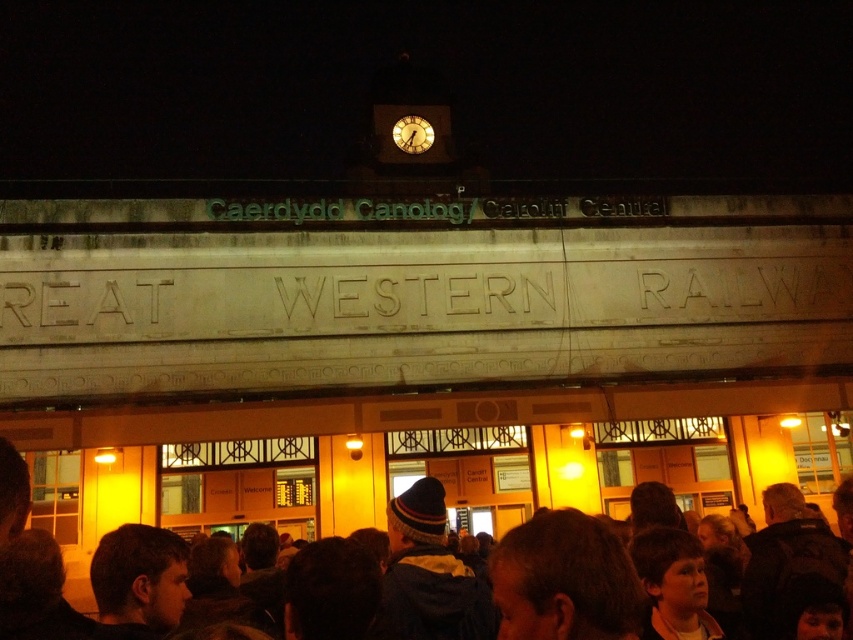
You are a traveler standing at the railway station entrance. You want to move from your current position to the matte white clock at center while avoiding the crowd around the brown woolen hat at center. Can you walk directly between them without any obstacles?

The distance between the brown woolen hat at center and the matte white clock at center is 50.02 meters, so yes, you can walk directly between them without any obstacles as there is sufficient space.